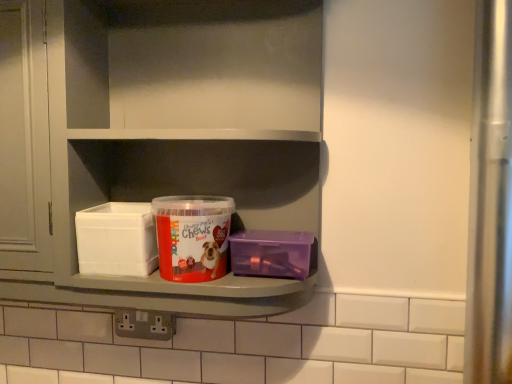
Question: Looking at their shapes, would you say red matte plastic container at center is wider or thinner than purple plastic container at right?

Choices:
 (A) wide
 (B) thin

Answer: (A)

Question: From their relative heights in the image, would you say red matte plastic container at center is taller or shorter than purple plastic container at right?

Choices:
 (A) tall
 (B) short

Answer: (A)

Question: Based on their relative distances, which object is nearer to the purple plastic container at right?

Choices:
 (A) red matte plastic container at center
 (B) white plastic shelf at center

Answer: (A)

Question: Which object is the closest to the red matte plastic container at center?

Choices:
 (A) white plastic shelf at center
 (B) purple plastic container at right

Answer: (B)